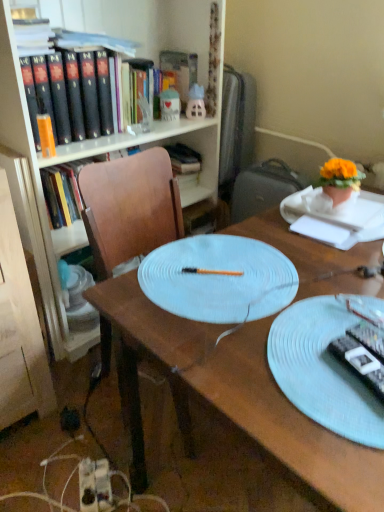
Find the location of a particular element. The height and width of the screenshot is (512, 384). vacant space that's between orange fabric flower pot at upper right and black plastic remote control at lower right, which appears as the second remote control when viewed from the right is located at coordinates (345, 270).